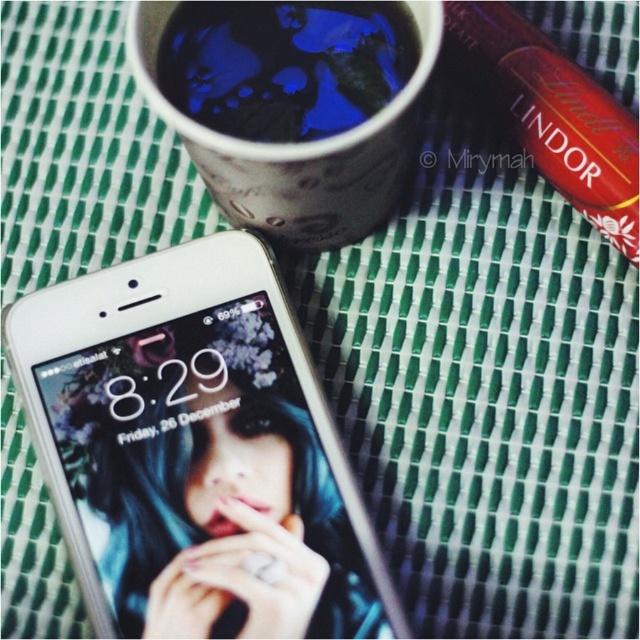
Question: Among these points, which one is farthest from the camera?

Choices:
 (A) (182, 93)
 (B) (241, 145)

Answer: (A)

Question: Which point is closer to the camera taking this photo?

Choices:
 (A) (248, 449)
 (B) (150, 102)
 (C) (211, 32)

Answer: (C)

Question: Is blue glossy mug at upper center positioned in front of blue matte cup at upper center?

Choices:
 (A) yes
 (B) no

Answer: (B)

Question: Is blue glossy mug at upper center closer to camera compared to blue matte cup at upper center?

Choices:
 (A) no
 (B) yes

Answer: (A)

Question: Considering the real-world distances, which object is closest to the blue glossy mug at upper center?

Choices:
 (A) silver metallic smartphone at lower left
 (B) blue matte cup at upper center

Answer: (B)

Question: Can you confirm if blue glossy mug at upper center is bigger than blue matte cup at upper center?

Choices:
 (A) yes
 (B) no

Answer: (B)